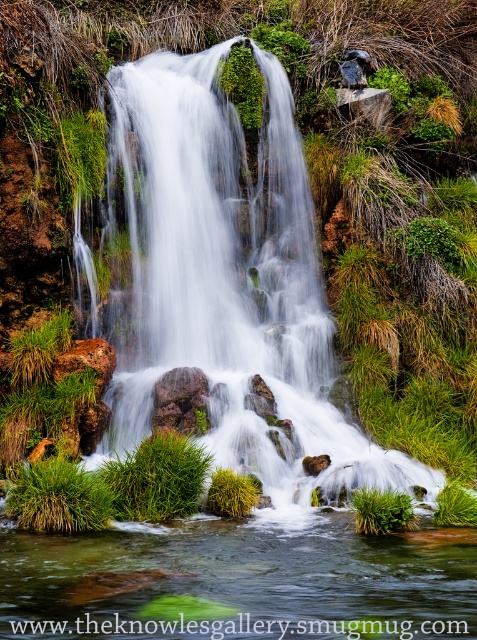
Is green grassy stream at center behind rusty rock at center?

No.

Is green grassy stream at center smaller than rusty rock at center?

No.

Is point (434, 538) closer to camera compared to point (55, 365)?

Yes.

The image size is (477, 640). In order to click on green grassy stream at center in this screenshot , I will do `click(239, 580)`.

Who is shorter, green grass at lower center or rusty rock at center?

With less height is green grass at lower center.

Who is more distant from viewer, (358, 492) or (65, 368)?

The point (65, 368) is behind.

The width and height of the screenshot is (477, 640). What do you see at coordinates (383, 509) in the screenshot?
I see `green grass at lower center` at bounding box center [383, 509].

Image resolution: width=477 pixels, height=640 pixels. Identify the location of green grass at lower center. (383, 509).

Identify the location of white smooth waterfall at center. The height and width of the screenshot is (640, 477). (228, 282).

Can you confirm if white smooth waterfall at center is positioned above green grassy stream at center?

Correct, white smooth waterfall at center is located above green grassy stream at center.

This screenshot has height=640, width=477. What do you see at coordinates (228, 282) in the screenshot?
I see `white smooth waterfall at center` at bounding box center [228, 282].

Find the location of `white smooth waterfall at center`. white smooth waterfall at center is located at coordinates (228, 282).